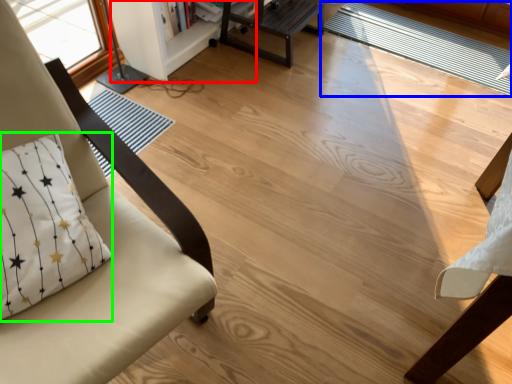
Question: Which object is positioned farthest from bookshelf (highlighted by a red box)? Select from mat (highlighted by a blue box) and pillow (highlighted by a green box).

Choices:
 (A) mat
 (B) pillow

Answer: (B)